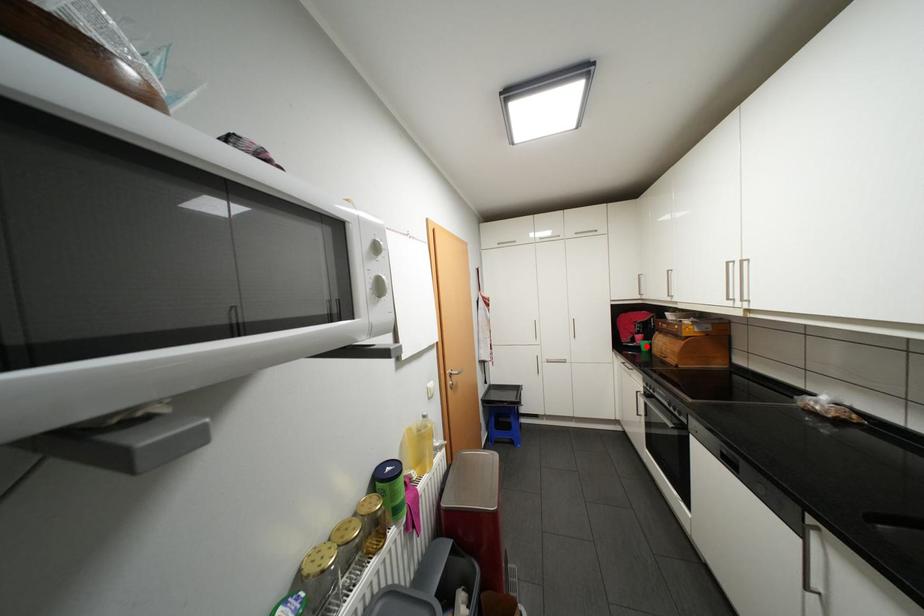
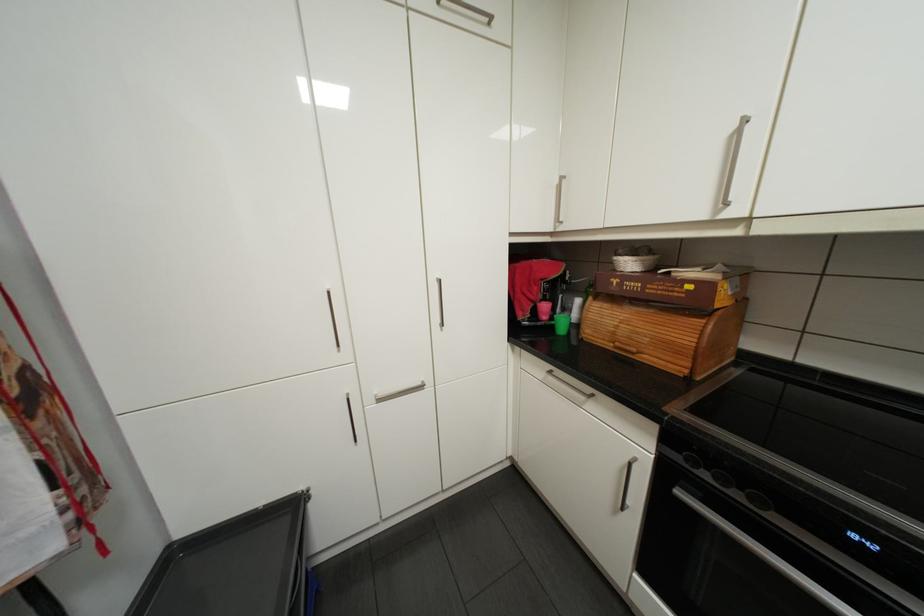
Locate, in the second image, the point that corresponds to the highlighted location in the first image.

(557, 328)